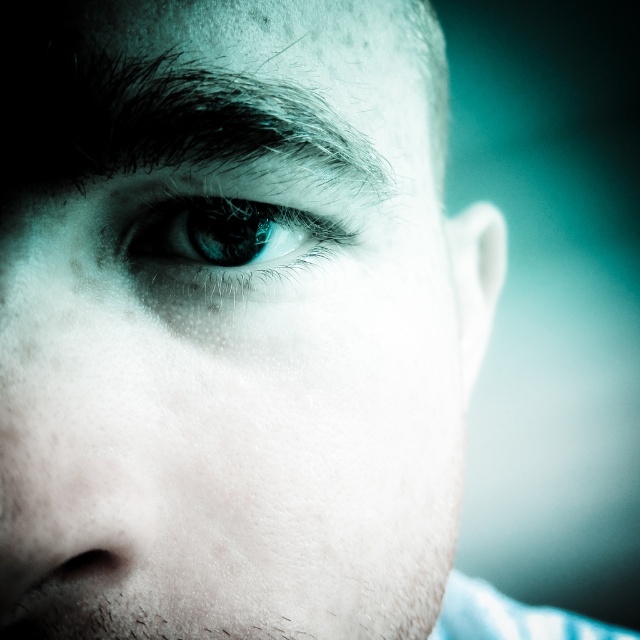
You are an artist sketching the portrait and want to add a highlight on the closer point between point (355, 328) and point (212, 216). Which point should you choose?

Point (355, 328) is further to the viewer than point (212, 216), so you should add the highlight on point (355, 328).

You are a makeup artist preparing to apply eyeliner to the smooth skin eye at center and the blue glossy eye at center. Which eye requires a thicker eyeliner application to accommodate its width?

The smooth skin eye at center requires a thicker eyeliner application because it might be wider than the blue glossy eye at center.

Based on the provided scene description, can you determine the exact coordinates of the smooth skin eye at center?

The smooth skin eye at center is located at point (227,326).